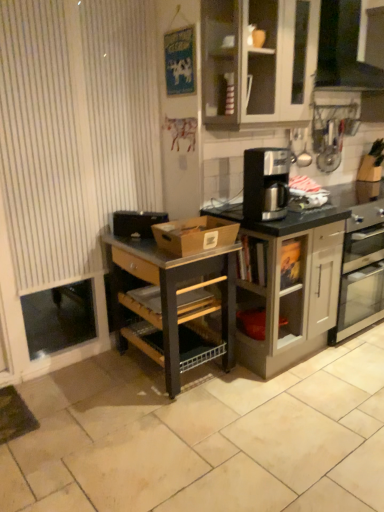
Question: Considering the relative sizes of matte gray cabinet at center, which is the 2th cabinetry in top-to-bottom order, and brown cardboard box at center in the image provided, is matte gray cabinet at center, which is the 2th cabinetry in top-to-bottom order, shorter than brown cardboard box at center?

Choices:
 (A) no
 (B) yes

Answer: (A)

Question: Does matte gray cabinet at center, the 1th cabinetry positioned from the bottom, have a smaller size compared to brown cardboard box at center?

Choices:
 (A) no
 (B) yes

Answer: (A)

Question: Can you confirm if matte gray cabinet at center, which is the 2th cabinetry in top-to-bottom order, is taller than brown cardboard box at center?

Choices:
 (A) yes
 (B) no

Answer: (A)

Question: Can you confirm if matte gray cabinet at center, which is the 2th cabinetry in top-to-bottom order, is wider than brown cardboard box at center?

Choices:
 (A) yes
 (B) no

Answer: (A)

Question: Looking at the image, does matte gray cabinet at center, the 1th cabinetry positioned from the bottom, seem bigger or smaller compared to black matte toaster at left?

Choices:
 (A) small
 (B) big

Answer: (B)

Question: From a real-world perspective, is matte gray cabinet at center, which is the 2th cabinetry in top-to-bottom order, physically located above or below black matte toaster at left?

Choices:
 (A) below
 (B) above

Answer: (A)

Question: From the image's perspective, relative to black matte toaster at left, is matte gray cabinet at center, which is the 2th cabinetry in top-to-bottom order, above or below?

Choices:
 (A) above
 (B) below

Answer: (B)

Question: In the image, is matte gray cabinet at center, the 1th cabinetry positioned from the bottom, on the left side or the right side of black matte toaster at left?

Choices:
 (A) left
 (B) right

Answer: (B)

Question: From a real-world perspective, is black plastic coffee maker at center positioned above or below brown cardboard box at center?

Choices:
 (A) above
 (B) below

Answer: (A)

Question: In terms of width, does black plastic coffee maker at center look wider or thinner when compared to brown cardboard box at center?

Choices:
 (A) thin
 (B) wide

Answer: (A)

Question: Considering their positions, is black plastic coffee maker at center located in front of or behind brown cardboard box at center?

Choices:
 (A) behind
 (B) front

Answer: (A)

Question: In terms of height, does black plastic coffee maker at center look taller or shorter compared to brown cardboard box at center?

Choices:
 (A) tall
 (B) short

Answer: (A)

Question: From a real-world perspective, is brown cardboard box at center above or below metallic black shelf at center?

Choices:
 (A) below
 (B) above

Answer: (B)

Question: In terms of width, does brown cardboard box at center look wider or thinner when compared to metallic black shelf at center?

Choices:
 (A) thin
 (B) wide

Answer: (A)